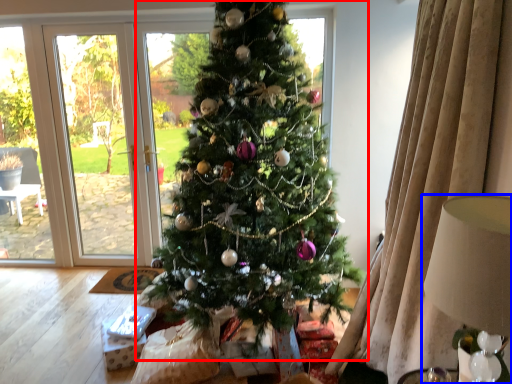
Question: Among these objects, which one is farthest to the camera, christmas tree (highlighted by a red box) or lamp (highlighted by a blue box)?

Choices:
 (A) christmas tree
 (B) lamp

Answer: (A)